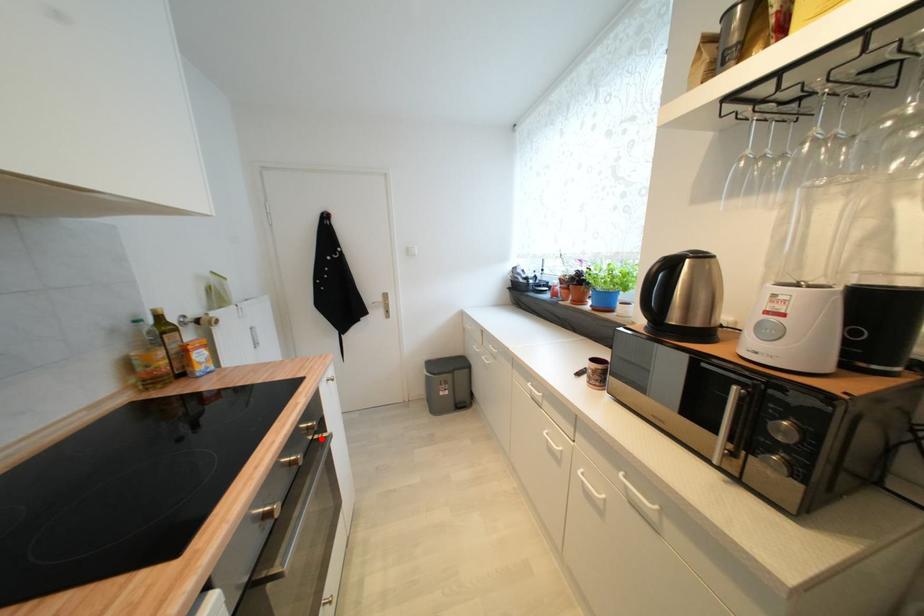
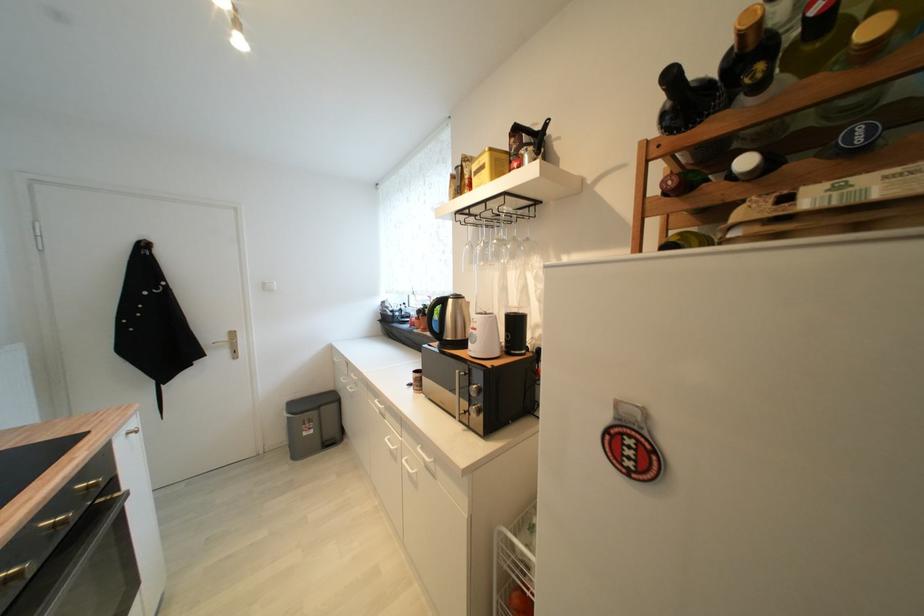
In the second image, find the point that corresponds to the highlighted location in the first image.

(107, 503)